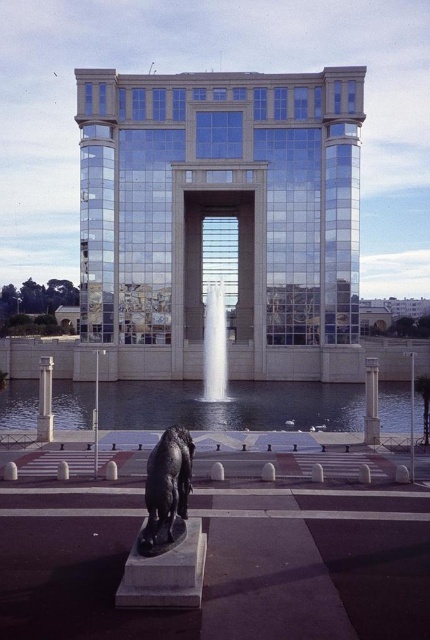
Does clear water at center come in front of white marble pillar at center?

No, clear water at center is behind white marble pillar at center.

Which is behind, point (405, 429) or point (39, 438)?

The point (405, 429) is behind.

Is point (273, 419) in front of point (46, 420)?

No, (273, 419) is further to viewer.

This screenshot has width=430, height=640. I want to click on clear water at center, so click(x=230, y=404).

Which is in front, point (389, 388) or point (168, 516)?

Point (168, 516)

Who is shorter, clear water at center or polished bronze statue at lower left?

Standing shorter between the two is clear water at center.

Between point (362, 419) and point (156, 461), which one is positioned in front?

Point (156, 461) is more forward.

Find the location of a particular element. This screenshot has width=430, height=640. clear water at center is located at coordinates (230, 404).

Between point (150, 461) and point (214, 368), which one is positioned behind?

The point (214, 368) is behind.

Between polished bronze statue at lower left and white glossy water at center, which one has less height?

polished bronze statue at lower left is shorter.

Is point (154, 516) farther from viewer compared to point (206, 388)?

No, (154, 516) is closer to viewer.

Identify the location of polished bronze statue at lower left. coord(166,484).